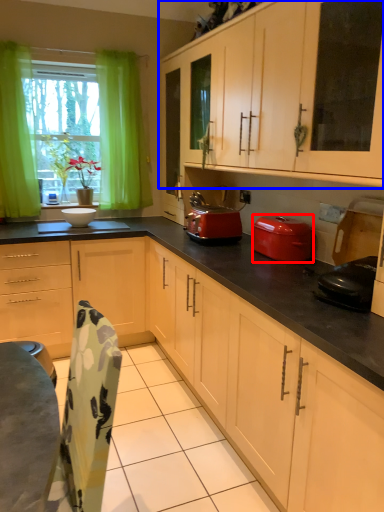
Question: Which point is closer to the camera, kitchen appliance (highlighted by a red box) or cabinetry (highlighted by a blue box)?

Choices:
 (A) kitchen appliance
 (B) cabinetry

Answer: (B)